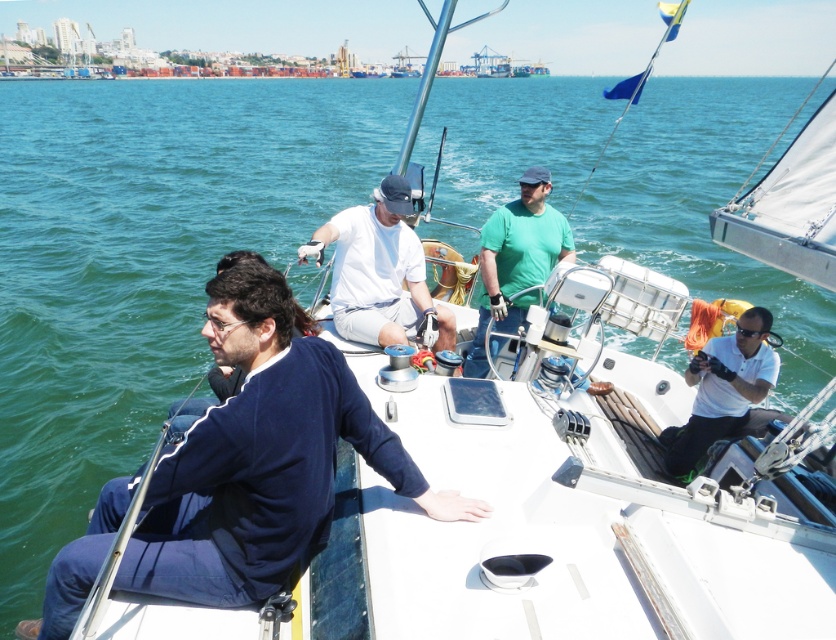
Question: Which object is the farthest from the navy blue sweater at left?

Choices:
 (A) white matte shirt at center
 (B) white matte camera at right
 (C) green matte shirt at center

Answer: (B)

Question: Can you confirm if white matte shirt at center is thinner than green matte shirt at center?

Choices:
 (A) no
 (B) yes

Answer: (A)

Question: Which point is farther to the camera?

Choices:
 (A) (x=228, y=472)
 (B) (x=508, y=211)
 (C) (x=380, y=300)

Answer: (B)

Question: Can you confirm if navy blue sweater at left is wider than green matte shirt at center?

Choices:
 (A) yes
 (B) no

Answer: (A)

Question: Does white matte shirt at center appear under white matte camera at right?

Choices:
 (A) yes
 (B) no

Answer: (B)

Question: Among these objects, which one is farthest from the camera?

Choices:
 (A) white matte shirt at center
 (B) white matte camera at right
 (C) green matte shirt at center
 (D) navy blue sweater at left

Answer: (C)